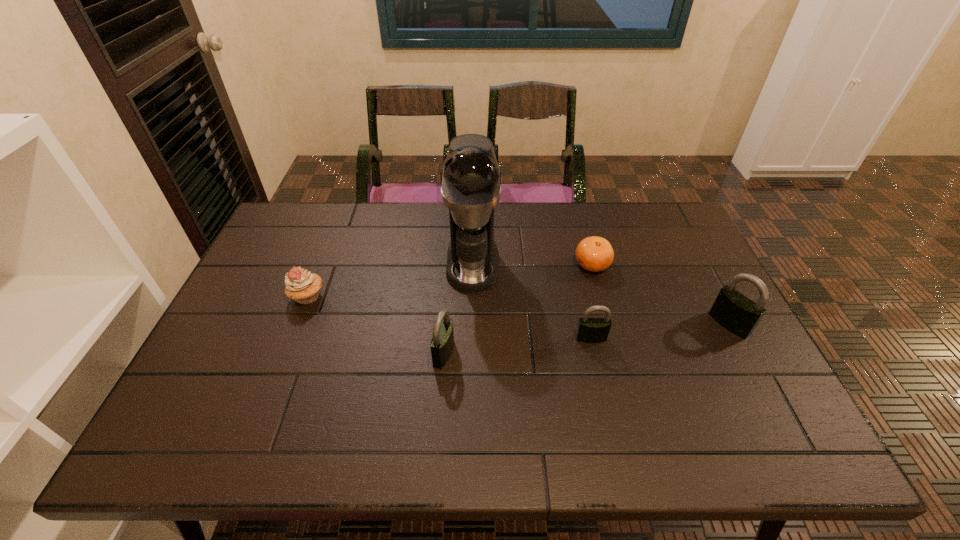
The height and width of the screenshot is (540, 960). What are the coordinates of `the leftmost padlock` in the screenshot? It's located at (442, 343).

Locate an element on the screen. The width and height of the screenshot is (960, 540). the fourth shortest object is located at coordinates (442, 343).

Identify the location of the shortest padlock. The image size is (960, 540). (589, 330).

At what (x,y) coordinates should I click in order to perform the action: click on the rightmost object. Please return your answer as a coordinate pair (x, y). This screenshot has height=540, width=960. Looking at the image, I should click on (738, 314).

Where is `coffee maker`? The image size is (960, 540). coffee maker is located at coordinates (470, 176).

At what (x,y) coordinates should I click in order to perform the action: click on clementine. Please return your answer as a coordinate pair (x, y). The width and height of the screenshot is (960, 540). Looking at the image, I should click on (594, 253).

This screenshot has height=540, width=960. I want to click on the leftmost object, so click(302, 286).

You are a GUI agent. You are given a task and a screenshot of the screen. Output one action in this format:
    pyautogui.click(x=<x>, y=<y>)
    Task: Click on the vacant space located 0.200m on the left of the second shortest padlock
    This screenshot has height=540, width=960.
    Given the screenshot: What is the action you would take?
    pyautogui.click(x=355, y=354)

You are a GUI agent. You are given a task and a screenshot of the screen. Output one action in this format:
    pyautogui.click(x=<x>, y=<y>)
    Task: Click on the vacant region located 0.260m on the right of the second padlock from right to left
    The image size is (960, 540).
    Given the screenshot: What is the action you would take?
    pyautogui.click(x=705, y=338)

This screenshot has height=540, width=960. Identify the location of free point located on the front of the rightmost padlock. (762, 386).